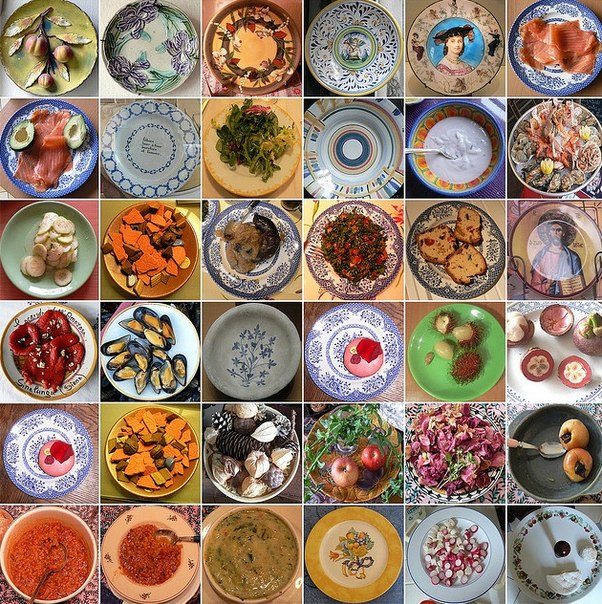
Locate an element on the screen. The height and width of the screenshot is (604, 602). bowls is located at coordinates (64, 568), (134, 568), (225, 580), (483, 172).